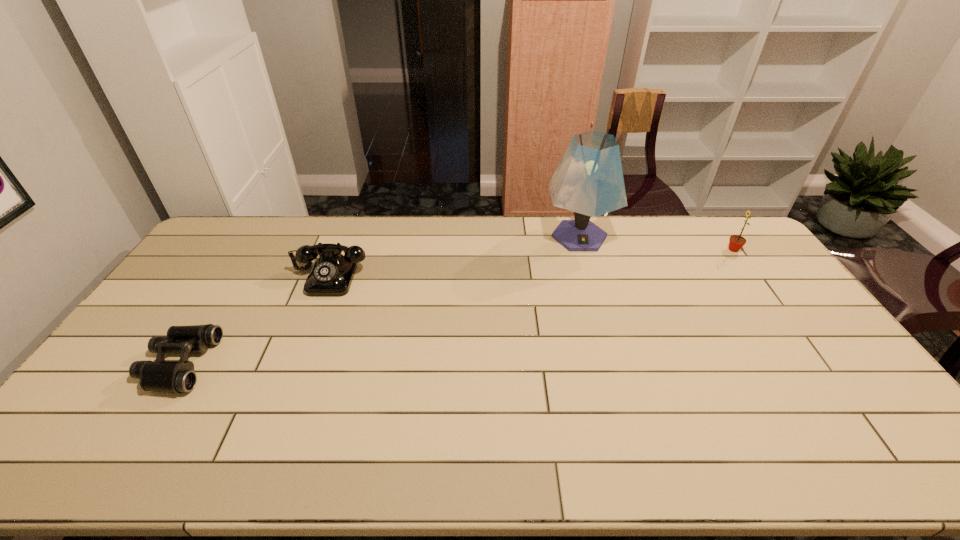
The height and width of the screenshot is (540, 960). I want to click on the second object from right to left, so click(x=589, y=181).

This screenshot has width=960, height=540. I want to click on lampshade, so click(x=589, y=181).

This screenshot has width=960, height=540. Find the location of `the rightmost object`. the rightmost object is located at coordinates (736, 242).

Locate an element on the screen. The image size is (960, 540). sunflower is located at coordinates (736, 242).

I want to click on the third object from right to left, so click(332, 273).

Image resolution: width=960 pixels, height=540 pixels. I want to click on the third tallest object, so click(x=332, y=273).

Locate an element on the screen. Image resolution: width=960 pixels, height=540 pixels. the nearest object is located at coordinates (177, 377).

What are the coordinates of `the leftmost object` in the screenshot? It's located at (177, 377).

The image size is (960, 540). Find the location of `free spot located on the base of the tallest object`. free spot located on the base of the tallest object is located at coordinates pyautogui.click(x=601, y=314).

Find the location of `free point located on the face of the rightmost object`. free point located on the face of the rightmost object is located at coordinates (684, 249).